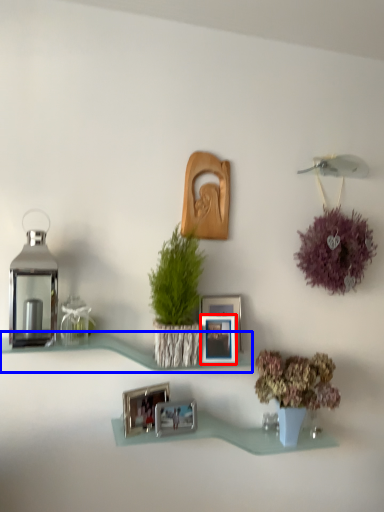
Question: Which point is closer to the camera, picture frame (highlighted by a red box) or shelf (highlighted by a blue box)?

Choices:
 (A) picture frame
 (B) shelf

Answer: (B)